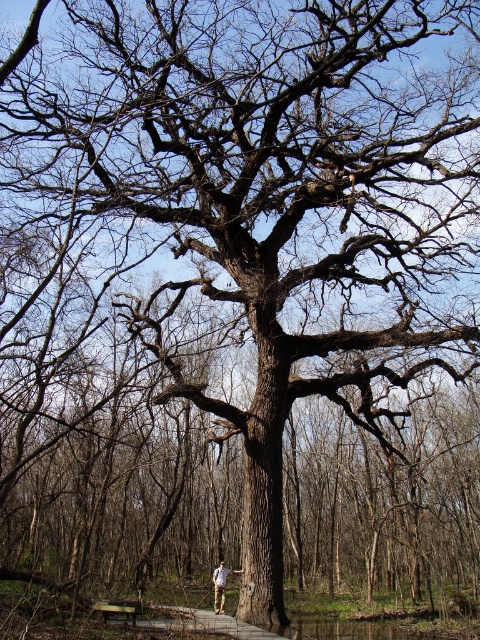
Question: Does wooden bench at lower center have a lesser width compared to khaki pants at center?

Choices:
 (A) yes
 (B) no

Answer: (A)

Question: In this image, where is wooden bench at lower center located relative to khaki pants at center?

Choices:
 (A) above
 (B) below

Answer: (A)

Question: Where is wooden bench at lower center located in relation to khaki pants at center in the image?

Choices:
 (A) below
 (B) above

Answer: (B)

Question: Which point is farther to the camera?

Choices:
 (A) tap(116, 611)
 (B) tap(226, 573)

Answer: (B)

Question: Among these points, which one is nearest to the camera?

Choices:
 (A) (220, 598)
 (B) (120, 609)

Answer: (B)

Question: Which object is closer to the camera taking this photo?

Choices:
 (A) khaki pants at center
 (B) wooden bench at lower center

Answer: (B)